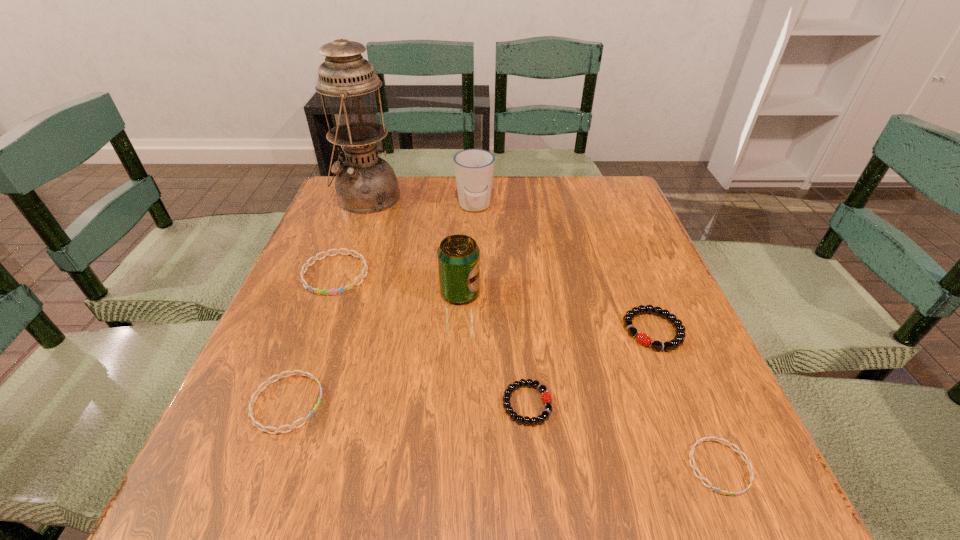
Locate an element on the screen. This screenshot has width=960, height=540. the nearest blue bracelet is located at coordinates (693, 466).

Where is `the nearest bracelet`? The image size is (960, 540). the nearest bracelet is located at coordinates (693, 466).

At what (x,y) coordinates should I click in order to perform the action: click on blank space located on the front of the tallest object. Please return your answer as a coordinate pair (x, y). Image resolution: width=960 pixels, height=540 pixels. Looking at the image, I should click on (344, 258).

This screenshot has height=540, width=960. In order to click on vacant region located 0.390m with a handle on the side of the cup in this screenshot , I will do `click(472, 327)`.

You are a GUI agent. You are given a task and a screenshot of the screen. Output one action in this format:
    pyautogui.click(x=<x>, y=<y>)
    Task: Click on the free space located on the right of the green beer can
    Image resolution: width=960 pixels, height=540 pixels.
    Given the screenshot: What is the action you would take?
    pyautogui.click(x=645, y=293)

Identify the location of vacant space located on the surface of the farthest bracelet showing star-shaped elements. (314, 331).

This screenshot has width=960, height=540. I want to click on vacant space located on the left of the fifth farthest object, so [x=448, y=330].

Locate an element on the screen. vacant area located 0.400m on the surface of the second smallest blue bracelet showing star-shaped elements is located at coordinates (556, 403).

The width and height of the screenshot is (960, 540). Find the location of `vacant area situated on the right of the third bracelet from right to left`. vacant area situated on the right of the third bracelet from right to left is located at coordinates (716, 404).

You are a GUI agent. You are given a task and a screenshot of the screen. Output one action in this format:
    pyautogui.click(x=<x>, y=<y>)
    Task: Click on the oil lamp located in the far edge section of the desktop
    
    Given the screenshot: What is the action you would take?
    pyautogui.click(x=365, y=183)